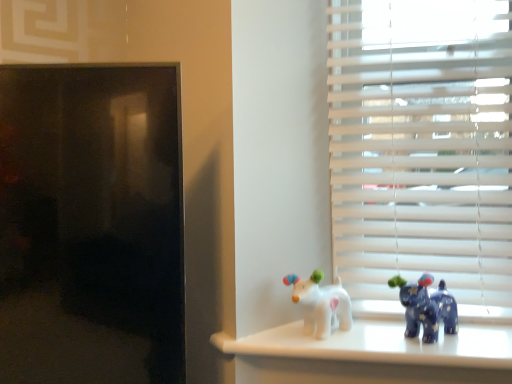
Question: Is white matte blinds at right not within blue glossy elephant at right, arranged as the first toy when viewed from the right?

Choices:
 (A) no
 (B) yes

Answer: (B)

Question: From a real-world perspective, is white matte blinds at right physically above blue glossy elephant at right, arranged as the first toy when viewed from the right?

Choices:
 (A) yes
 (B) no

Answer: (A)

Question: From the image's perspective, is white matte blinds at right under blue glossy elephant at right, acting as the second toy starting from the left?

Choices:
 (A) yes
 (B) no

Answer: (B)

Question: Is blue glossy elephant at right, acting as the second toy starting from the left, inside white matte blinds at right?

Choices:
 (A) yes
 (B) no

Answer: (B)

Question: From a real-world perspective, is white matte blinds at right physically below blue glossy elephant at right, acting as the second toy starting from the left?

Choices:
 (A) no
 (B) yes

Answer: (A)

Question: From their relative heights in the image, would you say white glossy dog at center, positioned as the 1th toy in left-to-right order, is taller or shorter than white matte blinds at right?

Choices:
 (A) short
 (B) tall

Answer: (A)

Question: Is point (323, 336) closer or farther from the camera than point (357, 155)?

Choices:
 (A) closer
 (B) farther

Answer: (A)

Question: From a real-world perspective, is white glossy dog at center, positioned as the 1th toy in left-to-right order, positioned above or below white matte blinds at right?

Choices:
 (A) above
 (B) below

Answer: (B)

Question: From the image's perspective, is white glossy dog at center, the second toy in the right-to-left sequence, positioned above or below white matte blinds at right?

Choices:
 (A) above
 (B) below

Answer: (B)

Question: Considering the positions of point (376, 36) and point (429, 337), is point (376, 36) closer or farther from the camera than point (429, 337)?

Choices:
 (A) closer
 (B) farther

Answer: (B)

Question: Is white matte blinds at right taller or shorter than blue glossy elephant at right, arranged as the first toy when viewed from the right?

Choices:
 (A) short
 (B) tall

Answer: (B)

Question: Is white matte blinds at right wider or thinner than blue glossy elephant at right, arranged as the first toy when viewed from the right?

Choices:
 (A) thin
 (B) wide

Answer: (B)

Question: Which is correct: white matte blinds at right is inside blue glossy elephant at right, acting as the second toy starting from the left, or outside of it?

Choices:
 (A) inside
 (B) outside

Answer: (B)

Question: Is blue glossy elephant at right, arranged as the first toy when viewed from the right, taller or shorter than white matte blinds at right?

Choices:
 (A) short
 (B) tall

Answer: (A)

Question: Is blue glossy elephant at right, acting as the second toy starting from the left, to the left or to the right of white matte blinds at right in the image?

Choices:
 (A) right
 (B) left

Answer: (B)